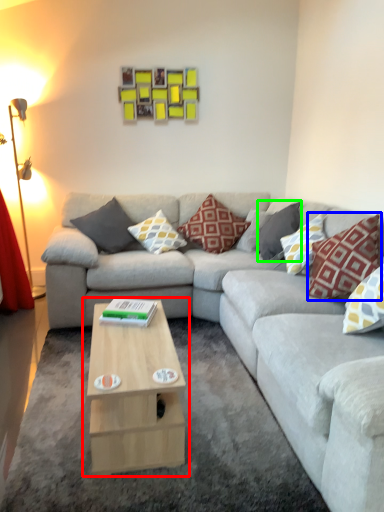
Question: Which object is the closest to the coffee table (highlighted by a red box)? Choose among these: pillow (highlighted by a blue box) or pillow (highlighted by a green box).

Choices:
 (A) pillow
 (B) pillow

Answer: (A)